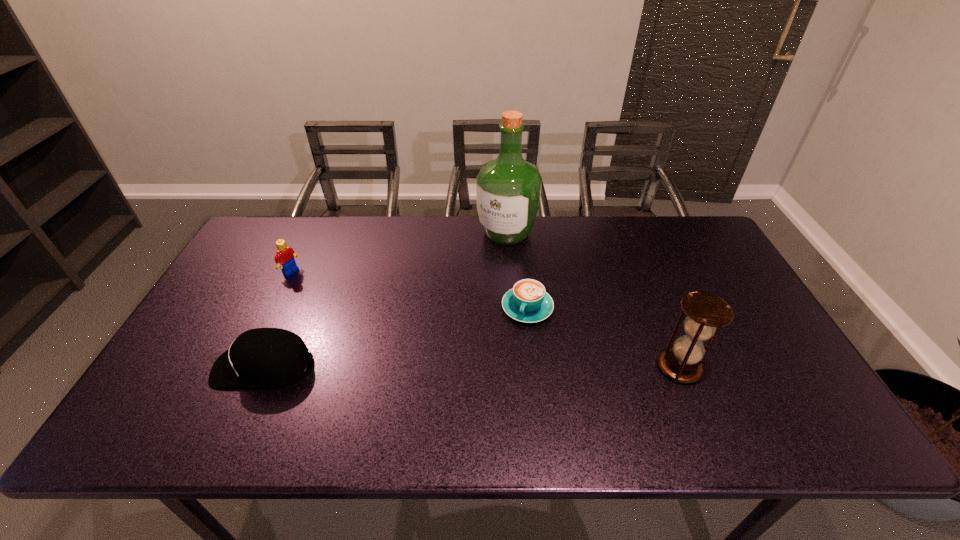
I want to click on free spot located 0.300m on the front-facing side of the liquor, so click(x=450, y=311).

Identify the location of free space located on the front-facing side of the liquor. [472, 280].

The image size is (960, 540). Find the location of `object that is positioned at the far edge`. object that is positioned at the far edge is located at coordinates (508, 189).

This screenshot has width=960, height=540. Find the location of `cap present at the near edge`. cap present at the near edge is located at coordinates (262, 357).

Locate an element on the screen. Image resolution: width=960 pixels, height=540 pixels. hourglass at the near edge is located at coordinates 706,313.

Find the location of a particular element. object located in the left edge section of the desktop is located at coordinates (262, 357).

Locate an element on the screen. object located in the near left corner section of the desktop is located at coordinates (262, 357).

The width and height of the screenshot is (960, 540). In the image, there is a desktop. Find the location of `vacant space at the far edge`. vacant space at the far edge is located at coordinates (416, 226).

I want to click on free space at the near edge of the desktop, so click(x=508, y=393).

This screenshot has width=960, height=540. What are the coordinates of `vacant region at the left edge` in the screenshot? It's located at (236, 269).